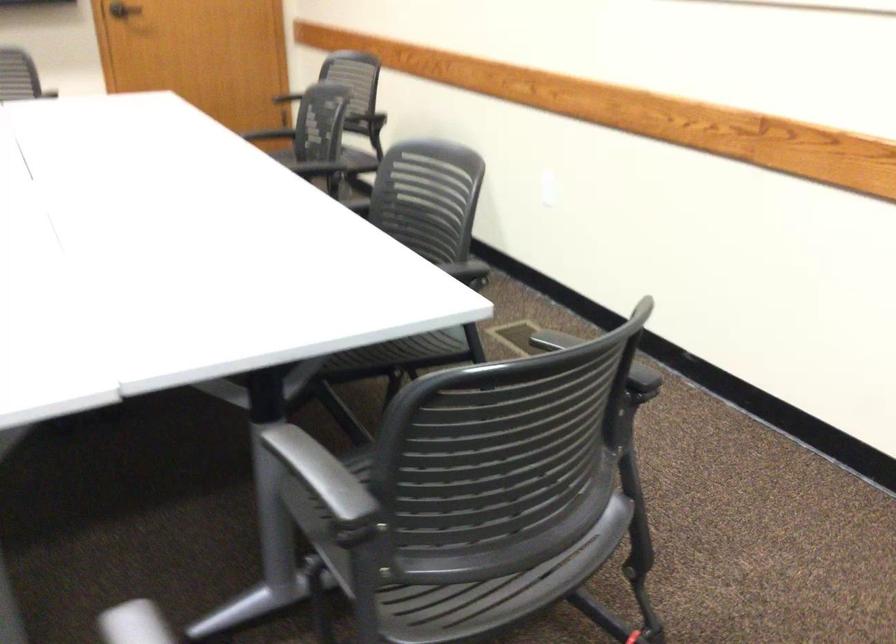
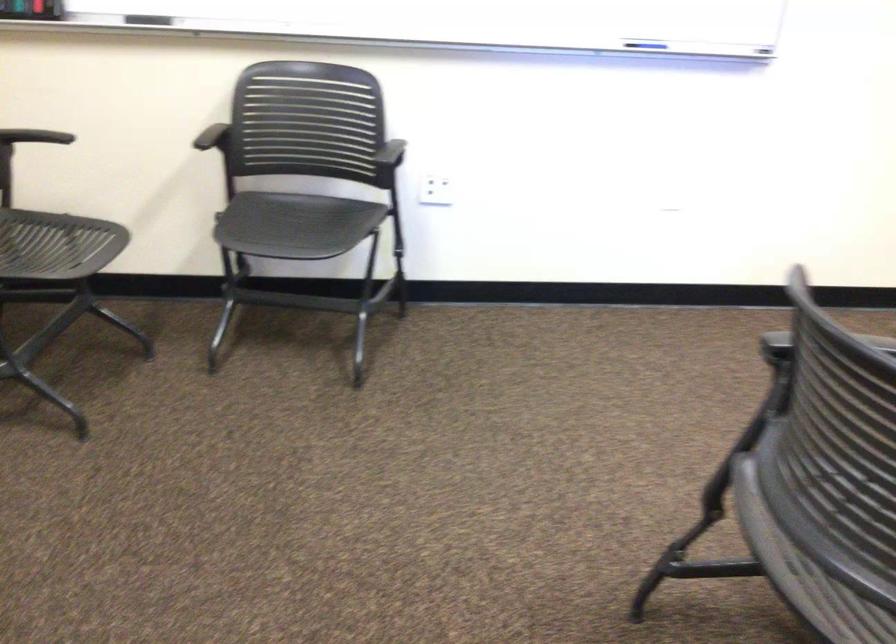
First-person continuous shooting, in which direction is the camera rotating?

The camera's rotation is toward left-down.